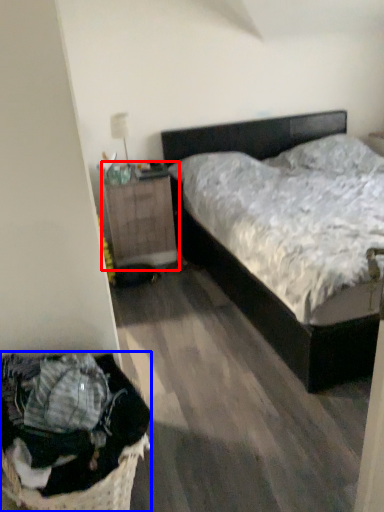
Question: Which object appears farthest to the camera in this image, nightstand (highlighted by a red box) or laundry basket (highlighted by a blue box)?

Choices:
 (A) nightstand
 (B) laundry basket

Answer: (A)